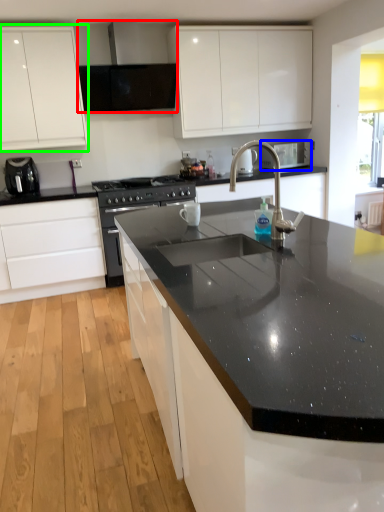
Question: Which is farther away from exhaust hood (highlighted by a red box)? appliance (highlighted by a blue box) or cabinetry (highlighted by a green box)?

Choices:
 (A) appliance
 (B) cabinetry

Answer: (A)